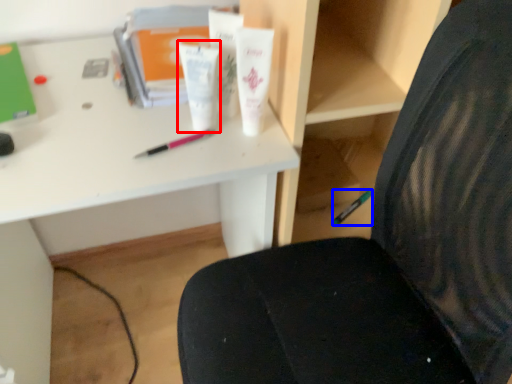
Question: Which of the following is the closest to the observer, toiletry (highlighted by a red box) or stationery (highlighted by a blue box)?

Choices:
 (A) toiletry
 (B) stationery

Answer: (A)